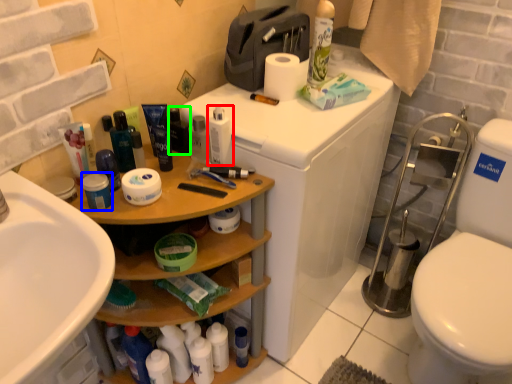
Question: Considering the real-world distances, which object is farthest from toiletry (highlighted by a red box)? toiletry (highlighted by a blue box) or toiletry (highlighted by a green box)?

Choices:
 (A) toiletry
 (B) toiletry

Answer: (A)